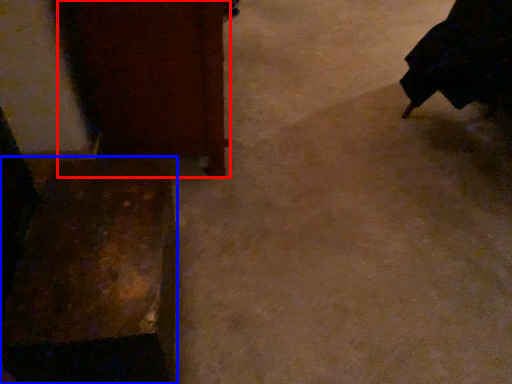
Question: Which point is further to the camera, furniture (highlighted by a red box) or furniture (highlighted by a blue box)?

Choices:
 (A) furniture
 (B) furniture

Answer: (A)